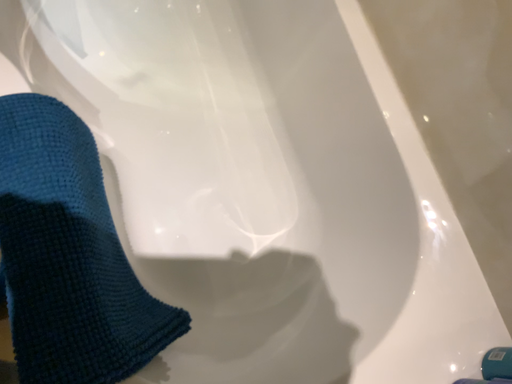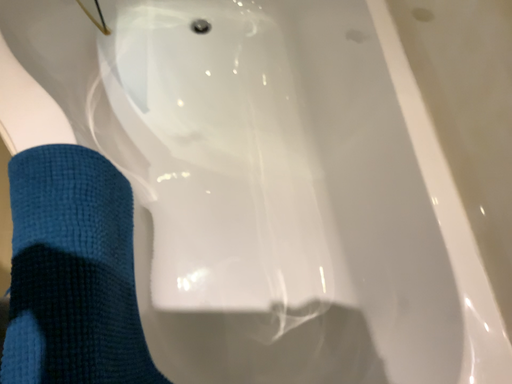
Question: Which way did the camera rotate in the video?

Choices:
 (A) rotated upward
 (B) rotated downward

Answer: (A)